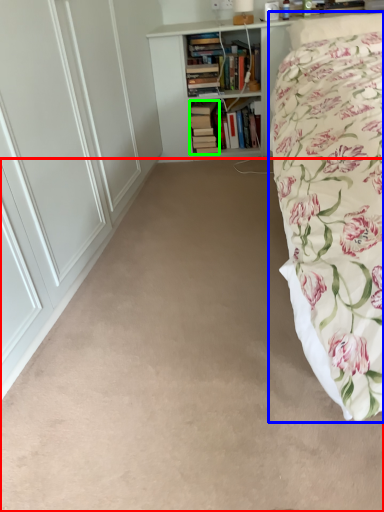
Question: Which object is positioned closest to plain (highlighted by a red box)? Select from bed (highlighted by a blue box) and book (highlighted by a green box).

Choices:
 (A) bed
 (B) book

Answer: (A)